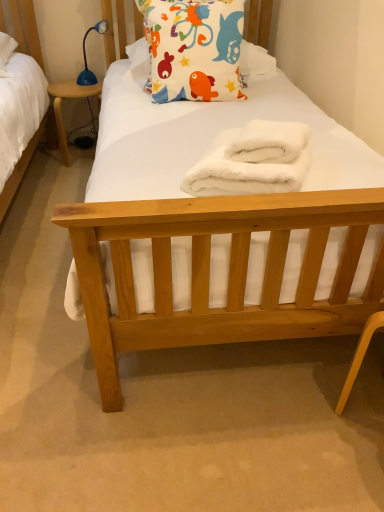
The width and height of the screenshot is (384, 512). I want to click on free location in front of blue plastic lamp at upper left, so click(x=80, y=91).